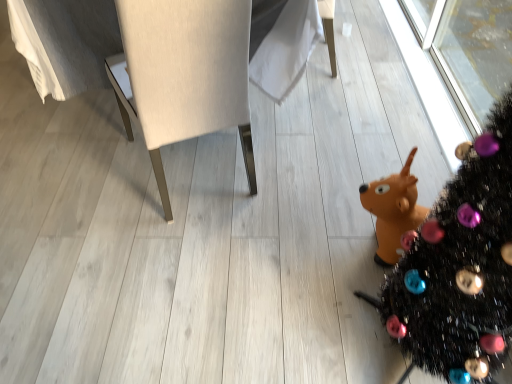
Locate an element on the screen. The image size is (512, 384). vacant space to the left of black glittery christmas tree at lower right is located at coordinates (298, 315).